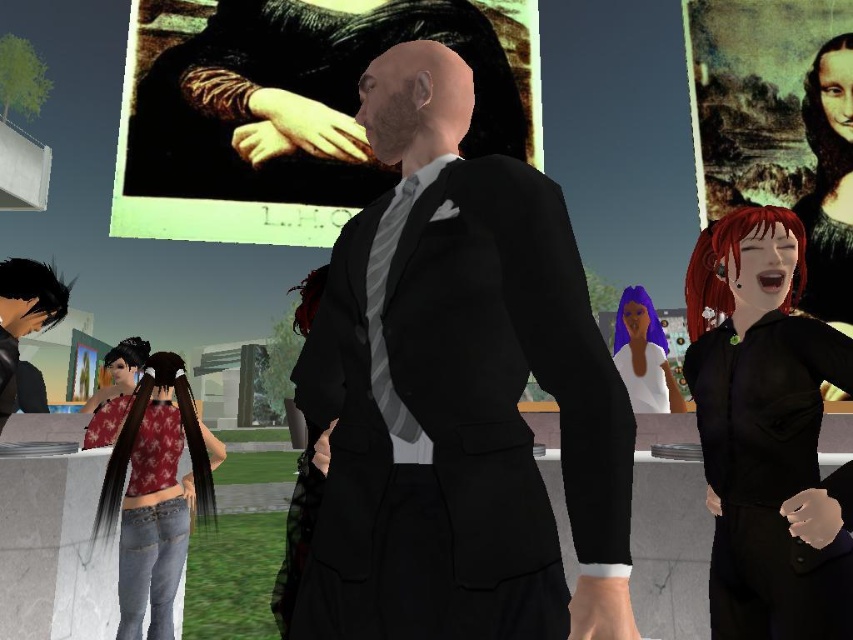
You are an art restorer working on a large canvas painting. You need to touch up a specific point at coordinates (753, 93). The painting is mounted on an easel in the scene. Where exactly on the painting should you apply the touch up?

The point at coordinates (753, 93) is located on the matte canvas painting at upper right, so you should apply the touch up there.

You are a delivery robot with a 1.5 meter long package. You need to move from the denim jeans at lower left to the matte black painting at upper center. Can you fit the package between them without tilting it?

The distance between the matte black painting at upper center and denim jeans at lower left is 2.30 meters, so yes, the robot can fit the 1.5 meter long package between them since the distance is greater than the package length.